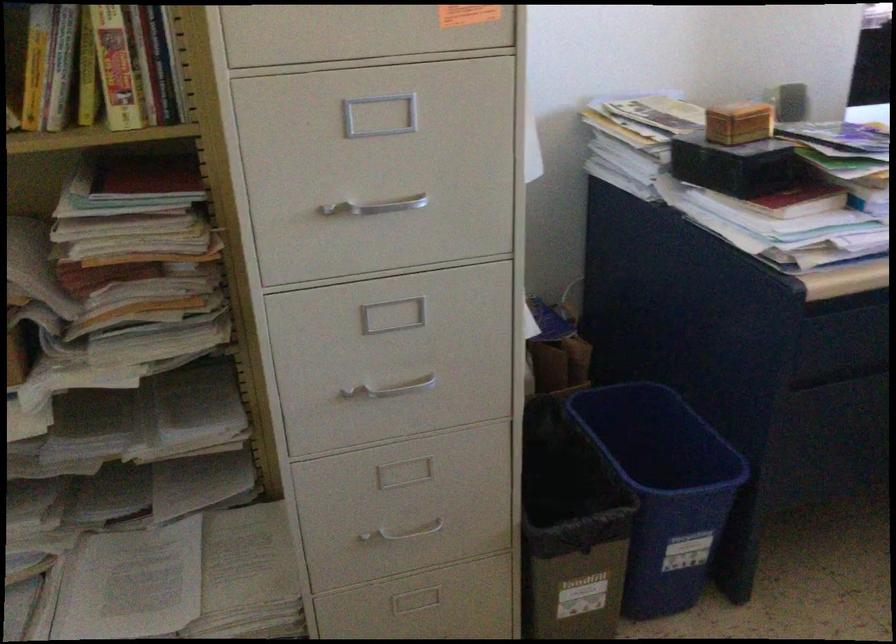
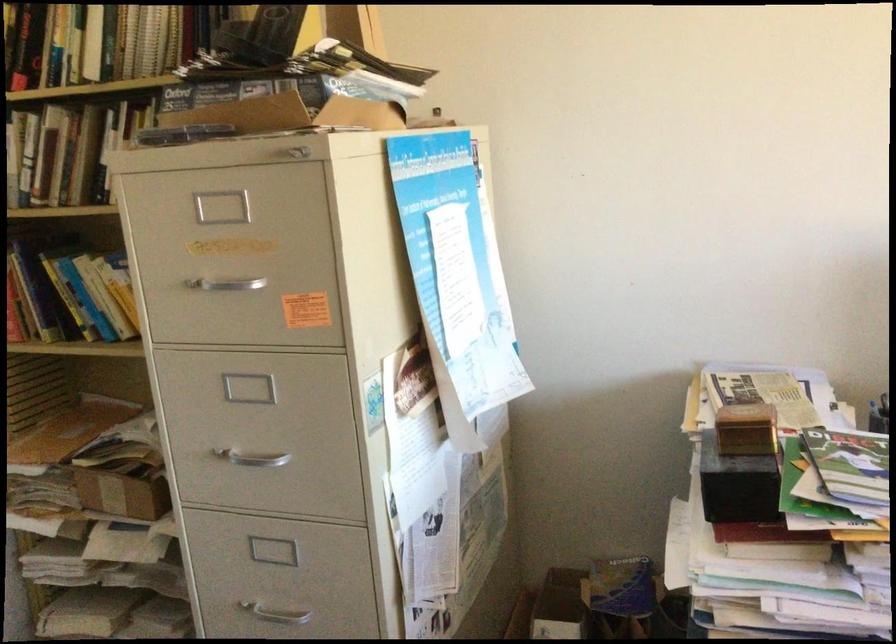
Locate, in the second image, the point that corresponds to [367,210] in the first image.

(251, 458)